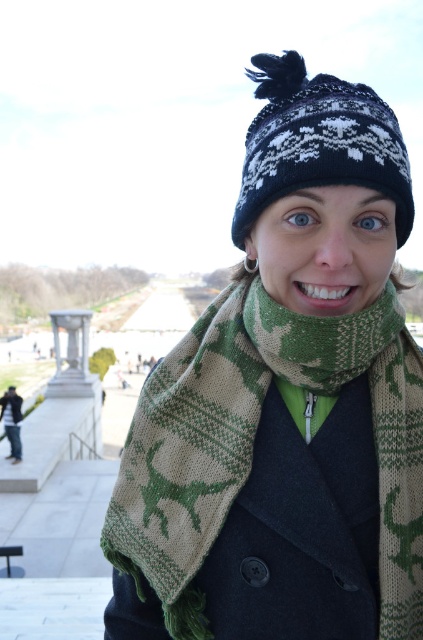
Question: Which of these objects is positioned closest to the black knitted hat at upper center?

Choices:
 (A) green knitted scarf at center
 (B) matte black coat at upper center

Answer: (A)

Question: Can you confirm if green knitted scarf at center is positioned below matte black coat at upper center?

Choices:
 (A) yes
 (B) no

Answer: (B)

Question: Among these objects, which one is nearest to the camera?

Choices:
 (A) matte black coat at upper center
 (B) black knitted hat at upper center

Answer: (B)

Question: Is green knitted scarf at center above black knitted hat at upper center?

Choices:
 (A) yes
 (B) no

Answer: (B)

Question: Which object appears closest to the camera in this image?

Choices:
 (A) black knitted hat at upper center
 (B) matte black coat at upper center
 (C) green knitted scarf at center

Answer: (C)

Question: Does black knitted hat at upper center appear on the right side of matte black coat at upper center?

Choices:
 (A) yes
 (B) no

Answer: (A)